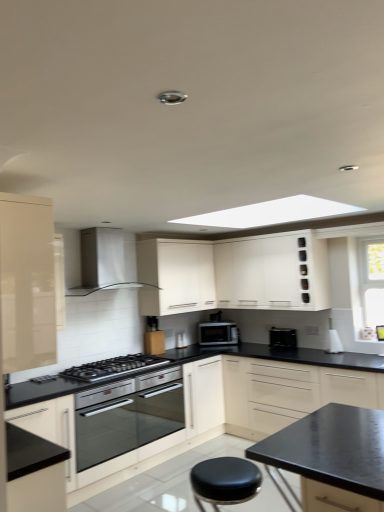
Question: Considering the relative positions of black matte toaster at lower center and white matte cabinet at center, placed as the 4th cabinetry when sorted from front to back, in the image provided, is black matte toaster at lower center to the left of white matte cabinet at center, placed as the 4th cabinetry when sorted from front to back, from the viewer's perspective?

Choices:
 (A) yes
 (B) no

Answer: (B)

Question: From the image's perspective, is black matte toaster at lower center over white matte cabinet at center, placed as the 4th cabinetry when sorted from front to back?

Choices:
 (A) no
 (B) yes

Answer: (A)

Question: From the image's perspective, would you say black matte toaster at lower center is shown under white matte cabinet at center, placed as the 4th cabinetry when sorted from front to back?

Choices:
 (A) no
 (B) yes

Answer: (B)

Question: Is white matte cabinet at center, which is the first cabinetry from back to front, at the back of black matte toaster at lower center?

Choices:
 (A) no
 (B) yes

Answer: (A)

Question: Does black matte toaster at lower center have a lesser height compared to white matte cabinet at center, which is the first cabinetry from back to front?

Choices:
 (A) yes
 (B) no

Answer: (A)

Question: From a real-world perspective, is black matte toaster at lower center positioned over white matte cabinet at center, placed as the 4th cabinetry when sorted from front to back, based on gravity?

Choices:
 (A) no
 (B) yes

Answer: (A)

Question: Does satin silver microwave at center contain black glass gas stove at center?

Choices:
 (A) no
 (B) yes

Answer: (A)

Question: Is satin silver microwave at center thinner than black glass gas stove at center?

Choices:
 (A) yes
 (B) no

Answer: (A)

Question: Does satin silver microwave at center have a lesser height compared to black glass gas stove at center?

Choices:
 (A) no
 (B) yes

Answer: (A)

Question: Is satin silver microwave at center taller than black glass gas stove at center?

Choices:
 (A) no
 (B) yes

Answer: (B)

Question: Is satin silver microwave at center aimed at black glass gas stove at center?

Choices:
 (A) yes
 (B) no

Answer: (B)

Question: Does satin silver microwave at center appear on the left side of black glass gas stove at center?

Choices:
 (A) no
 (B) yes

Answer: (A)

Question: Is black leather stool at lower center at the right side of satin silver microwave at center?

Choices:
 (A) no
 (B) yes

Answer: (A)